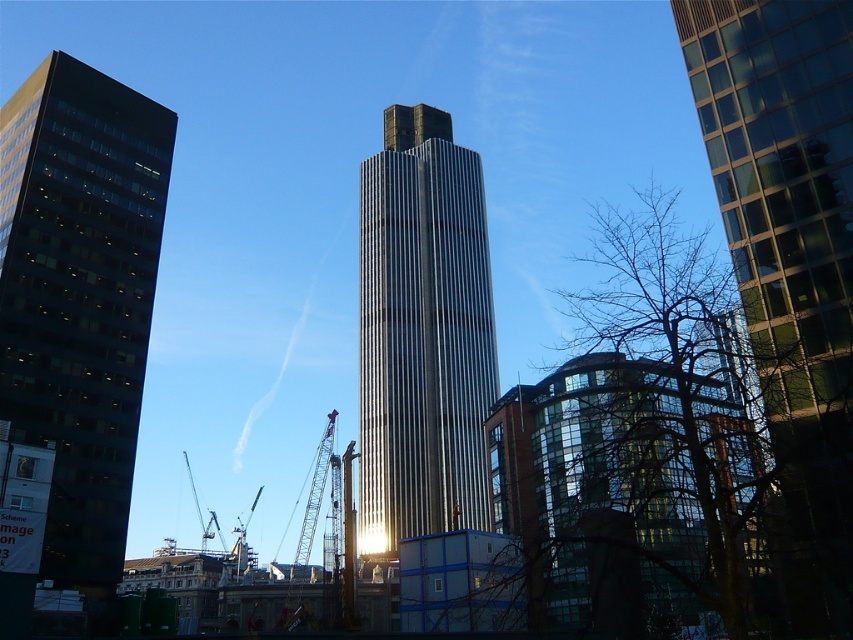
Is matte glass skyscraper at left closer to camera compared to metallic gray crane at center?

Yes, it is.

I want to click on matte glass skyscraper at left, so click(79, 298).

Can you confirm if glassy reflective skyscraper at center is positioned above metallic silver tower at center?

No.

Find the location of a particular element. This screenshot has height=640, width=853. glassy reflective skyscraper at center is located at coordinates (788, 259).

Describe the element at coordinates (788, 259) in the screenshot. I see `glassy reflective skyscraper at center` at that location.

Identify the location of glassy reflective skyscraper at center. This screenshot has width=853, height=640. (788, 259).

Looking at this image, does matte glass skyscraper at left lie behind metallic silver tower at center?

That is False.

Is point (53, 557) positioned behind point (434, 465)?

No.

Where is `matte glass skyscraper at left`? The image size is (853, 640). matte glass skyscraper at left is located at coordinates (79, 298).